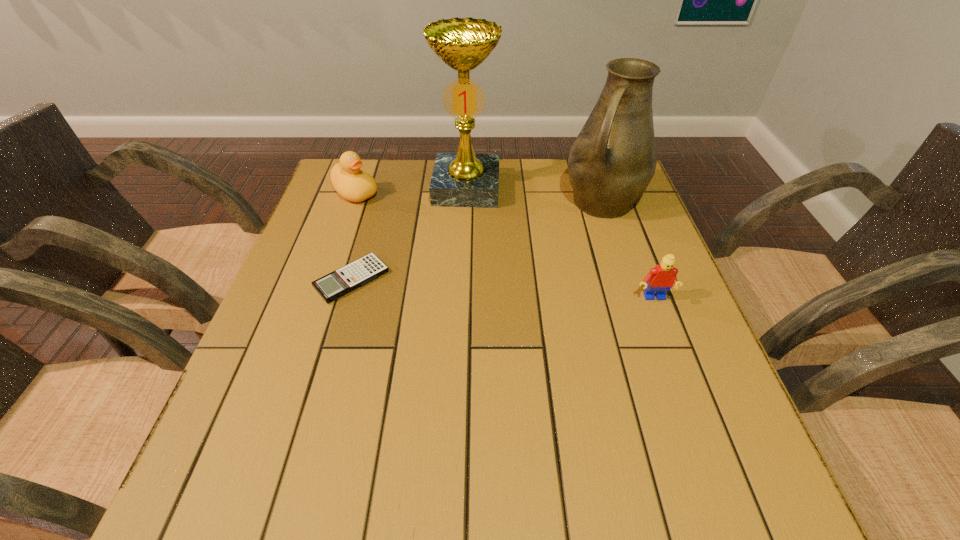
Locate an element on the screen. The height and width of the screenshot is (540, 960). duck that is at the left edge is located at coordinates (353, 184).

You are a GUI agent. You are given a task and a screenshot of the screen. Output one action in this format:
    pyautogui.click(x=<x>, y=<y>)
    Task: Click on the Lego that is positioned at the right edge
    
    Given the screenshot: What is the action you would take?
    pyautogui.click(x=661, y=278)

Find the location of `pitcher present at the right edge`. pitcher present at the right edge is located at coordinates (613, 159).

This screenshot has width=960, height=540. I want to click on object that is at the far left corner, so click(x=353, y=184).

The height and width of the screenshot is (540, 960). What are the coordinates of `object located at the far right corner` in the screenshot? It's located at (613, 159).

Where is `vacant space at the far edge`? vacant space at the far edge is located at coordinates (398, 179).

In the image, there is a desktop. Where is `free region at the near edge`? This screenshot has height=540, width=960. free region at the near edge is located at coordinates (329, 427).

In the image, there is a desktop. Where is `blank space at the left edge`? This screenshot has width=960, height=540. blank space at the left edge is located at coordinates (267, 383).

What are the coordinates of `free point at the right edge` in the screenshot? It's located at (651, 268).

The width and height of the screenshot is (960, 540). I want to click on vacant space at the far left corner, so click(x=333, y=199).